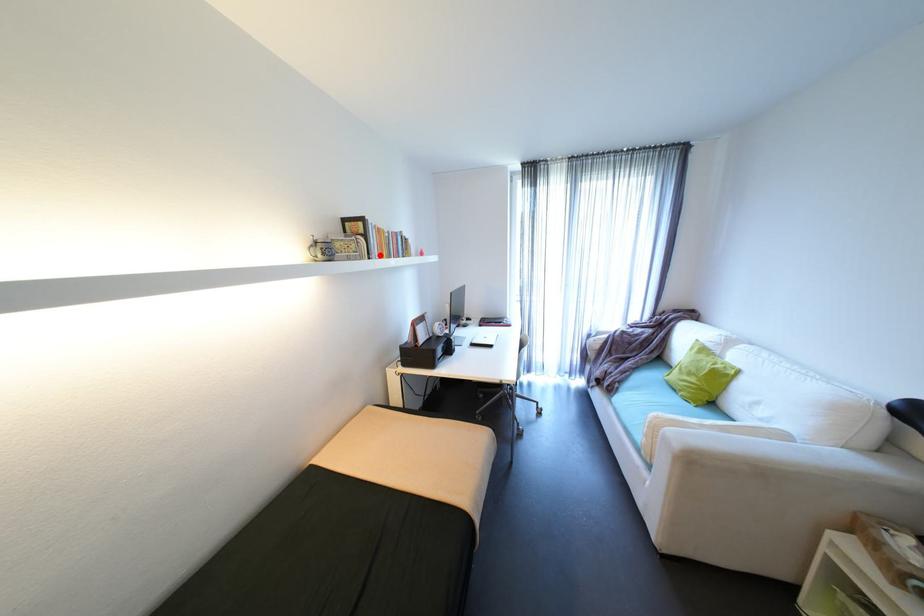
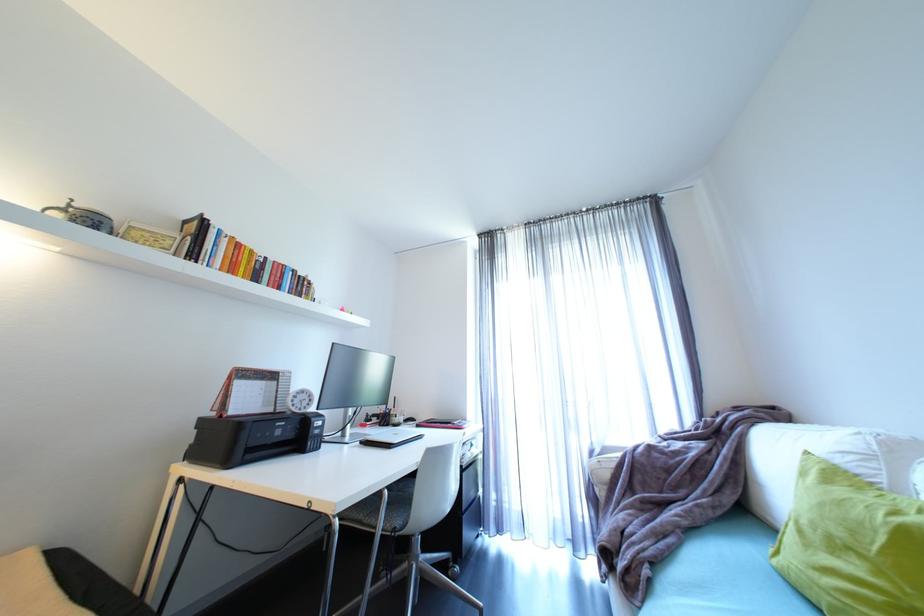
The point at the highlighted location is marked in the first image. Where is the corresponding point in the second image?

(208, 262)